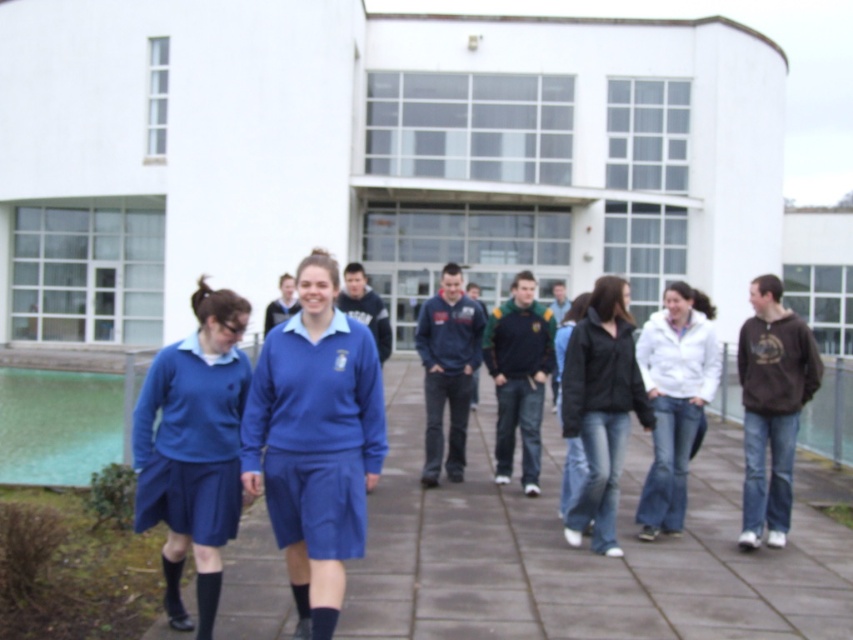
Can you confirm if blue fabric skirt at center is positioned below black matte jacket at center?

Yes.

Can you confirm if blue fabric skirt at center is taller than black matte jacket at center?

No, blue fabric skirt at center is not taller than black matte jacket at center.

Find the location of a particular element. The height and width of the screenshot is (640, 853). blue fabric skirt at center is located at coordinates (x=585, y=548).

This screenshot has width=853, height=640. Identify the location of brown cotton hoodie at right. (772, 412).

Can you confirm if brown cotton hoodie at right is positioned below black matte sweatshirt at center?

Indeed, brown cotton hoodie at right is positioned under black matte sweatshirt at center.

Does point (817, 364) lie in front of point (589, 340)?

No, it is not.

Where is `brown cotton hoodie at right`? This screenshot has width=853, height=640. brown cotton hoodie at right is located at coordinates (772, 412).

Can you confirm if white matte jacket at center is positioned to the left of navy blue fleece at center?

No, white matte jacket at center is not to the left of navy blue fleece at center.

Is white matte jacket at center to the right of navy blue fleece at center from the viewer's perspective?

Yes, white matte jacket at center is to the right of navy blue fleece at center.

The width and height of the screenshot is (853, 640). What do you see at coordinates (674, 400) in the screenshot?
I see `white matte jacket at center` at bounding box center [674, 400].

Where is `white matte jacket at center`? white matte jacket at center is located at coordinates (674, 400).